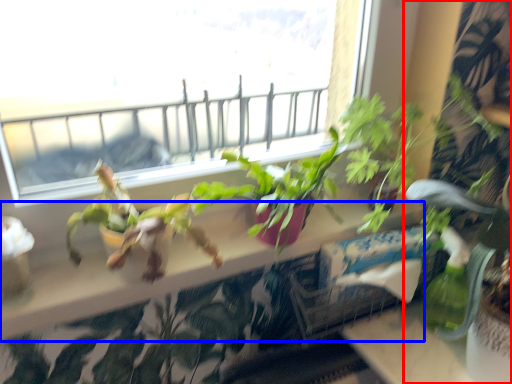
Question: Which point is closer to the camera, houseplant (highlighted by a red box) or window sill (highlighted by a blue box)?

Choices:
 (A) houseplant
 (B) window sill

Answer: (A)